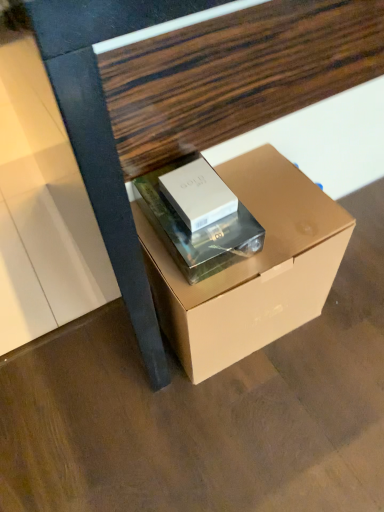
Find the location of a particular element. This screenshot has height=512, width=384. vacant area located to the right-hand side of silver metallic box at center, acting as the first box starting from the left is located at coordinates (282, 210).